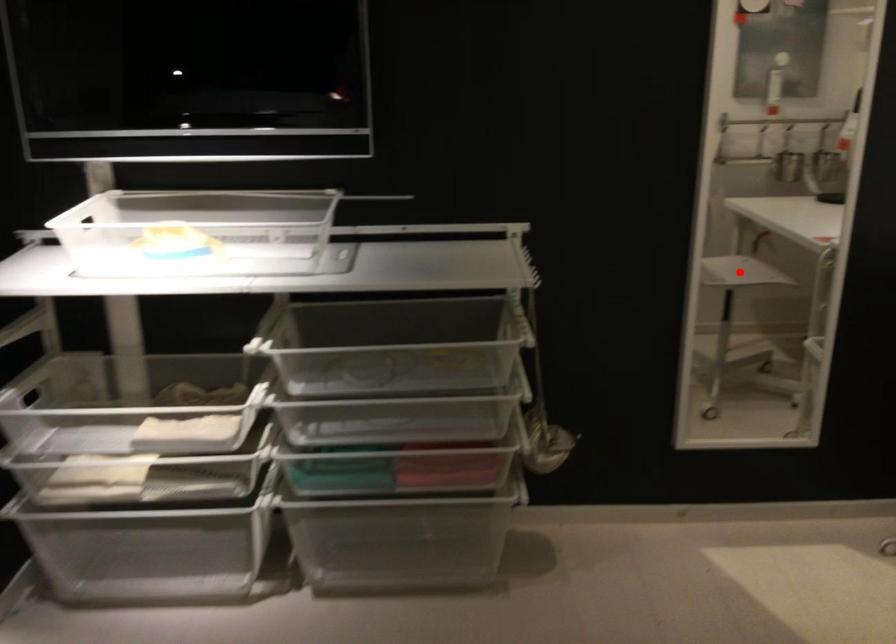
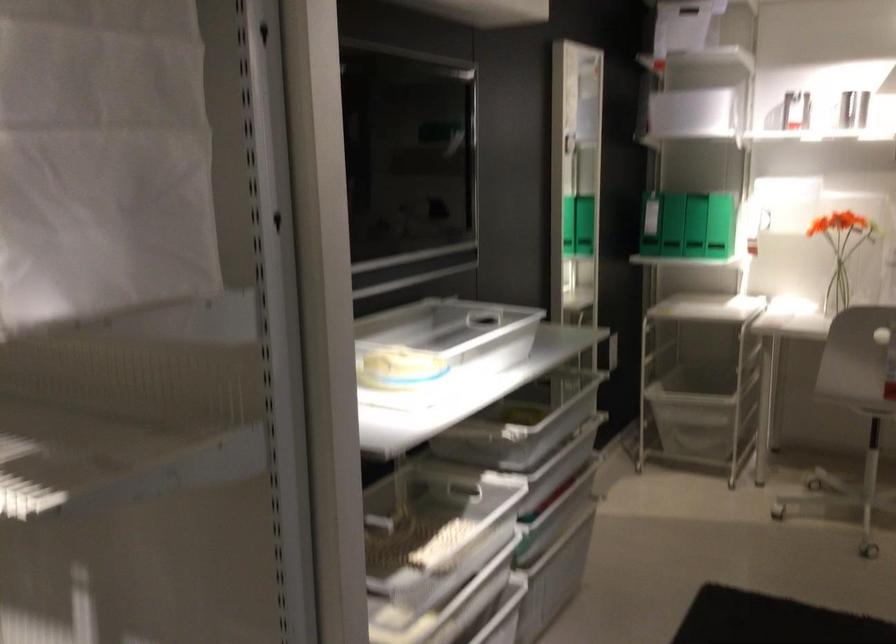
Question: I am providing you with two images of the same scene from different viewpoints. A red point is marked on the first image. Is the red point's position out of view in image 2?

Choices:
 (A) Yes
 (B) No

Answer: (A)